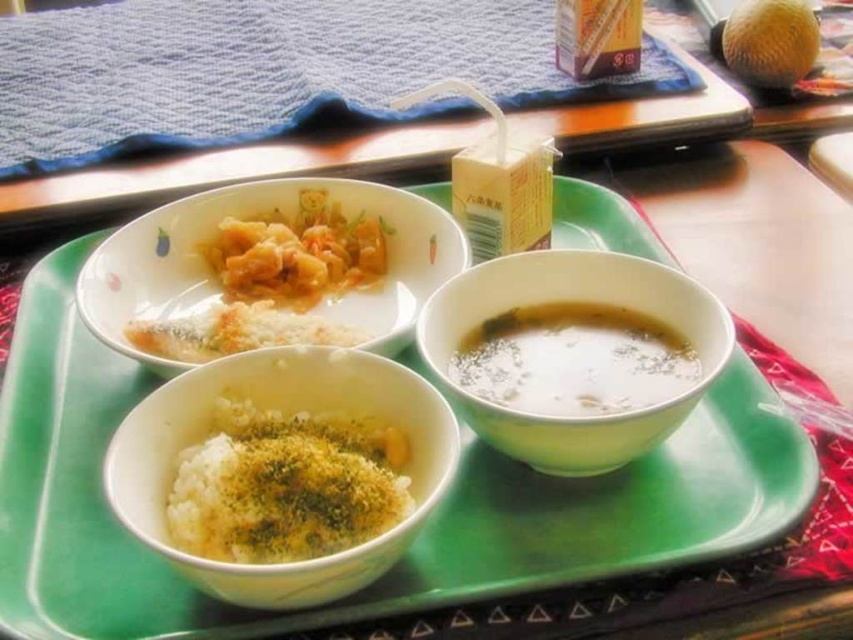
Does white matte rice bowl at lower left have a greater width compared to green ceramic bowl at lower right?

No.

At what (x,y) coordinates should I click in order to perform the action: click on white matte rice bowl at lower left. Please return your answer as a coordinate pair (x, y). This screenshot has width=853, height=640. Looking at the image, I should click on (276, 400).

Is point (44, 580) positioned after point (473, 358)?

No, (44, 580) is closer to viewer.

Is green ceramic tray at center bigger than white creamy soup at bottom right?

Correct, green ceramic tray at center is larger in size than white creamy soup at bottom right.

Locate an element on the screen. green ceramic tray at center is located at coordinates tap(419, 536).

Who is higher up, white glossy bowl at upper left or yellowish matte shrimp at upper left?

yellowish matte shrimp at upper left is higher up.

Is white glossy bowl at upper left below yellowish matte shrimp at upper left?

Yes, white glossy bowl at upper left is below yellowish matte shrimp at upper left.

Does point (231, 196) come behind point (376, 275)?

Yes, it is.

Locate an element on the screen. This screenshot has height=640, width=853. white glossy bowl at upper left is located at coordinates (247, 214).